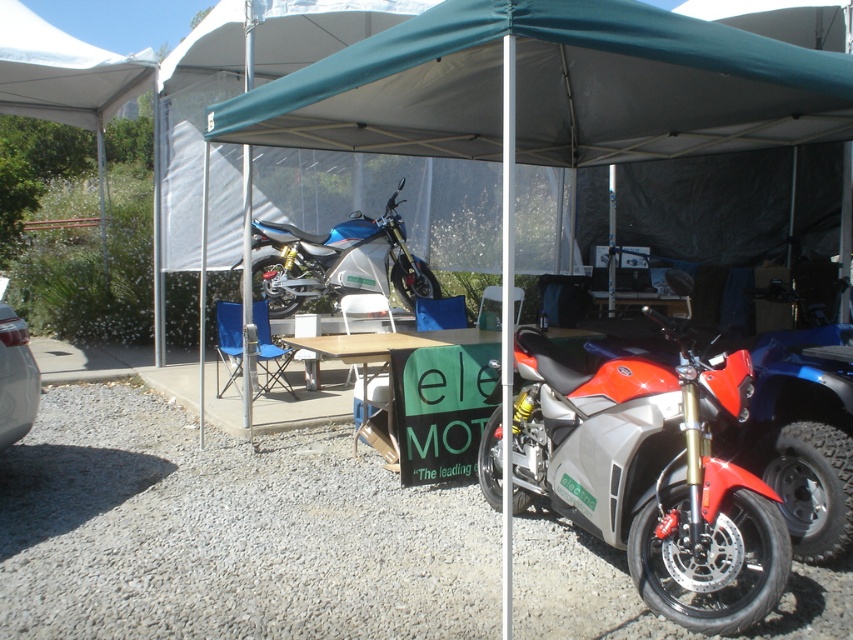
You are standing in front of the canopy tent and want to walk from the blue metallic motorcycle at center to the metallic silver car at lower left. Which direction should you move relative to the motorcycle?

You should move towards the lower left direction relative to the blue metallic motorcycle at center to reach the metallic silver car at lower left since the motorcycle is closer to you than the car.

You are a photographer setting up for a shoot under the large canopy tent. You need to position a light source so that it illuminates both the matte silver motorcycle at center and the blue metallic motorcycle at center without casting shadows on the backdrop. Given their height difference, which motorcycle should the light be angled towards first?

The matte silver motorcycle at center is taller than the blue metallic motorcycle at center, so the light should be angled towards the matte silver motorcycle at center first to ensure both are properly illuminated without casting shadows on the backdrop.

You are a photographer setting up for a photoshoot under the canopy tent. You need to position a light to the left of the matte silver motorcycle at center and another light to the right of the blue metallic motorcycle at center. Will the two lights be placed on the same side relative to each other?

The matte silver motorcycle at center is positioned on the right side of the blue metallic motorcycle at center. Therefore, placing a light to the left of the matte silver motorcycle and another to the right of the blue metallic motorcycle would result in the lights being on opposite sides of the motorcycles. The light on the matte silver motorcycle would be to the left of it, which would be the same side as the right side of the blue metallic motorcycle. However, since the blue metallic motorcycle is to 1